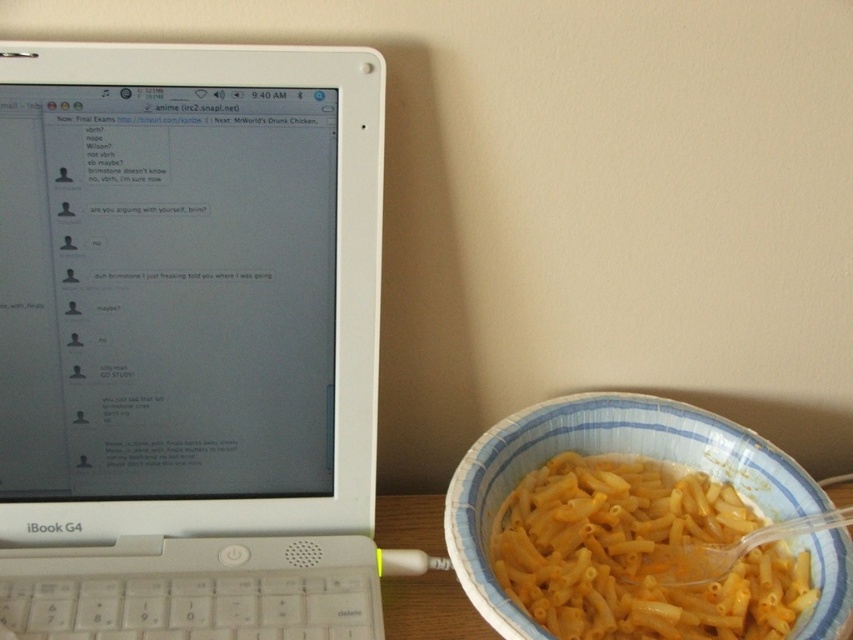
Between white plastic laptop at left and yellow matte pasta at right, which one appears on the right side from the viewer's perspective?

yellow matte pasta at right is more to the right.

Which of these two, white plastic laptop at left or yellow matte pasta at right, stands shorter?

With less height is yellow matte pasta at right.

What do you see at coordinates (189, 340) in the screenshot?
I see `white plastic laptop at left` at bounding box center [189, 340].

Identify the location of white plastic laptop at left. Image resolution: width=853 pixels, height=640 pixels. (189, 340).